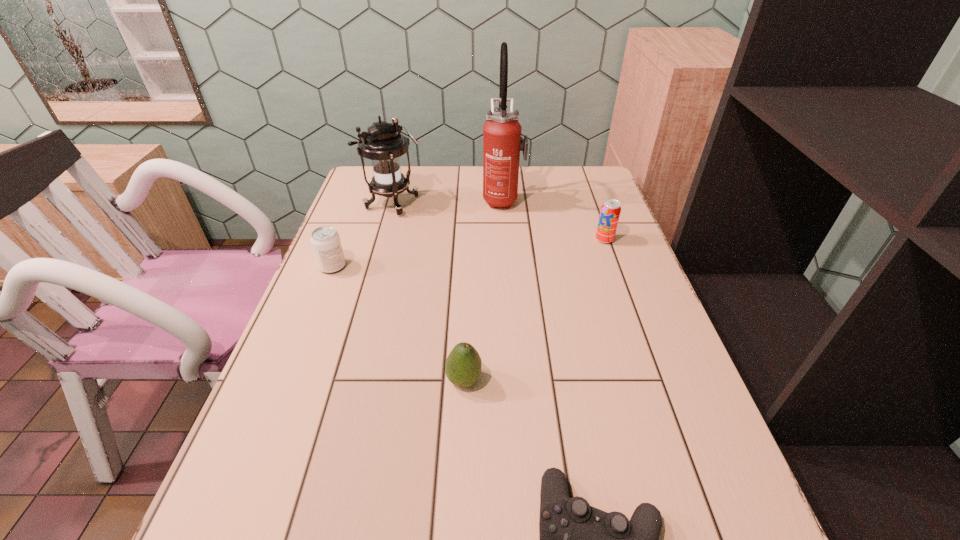
The image size is (960, 540). Identify the location of object present at the far left corner. (383, 143).

You are a GUI agent. You are given a task and a screenshot of the screen. Output one action in this format:
    pyautogui.click(x=<x>, y=<y>)
    Task: Click on the vacant position at the far edge of the desktop
    Image resolution: width=960 pixels, height=540 pixels.
    Given the screenshot: What is the action you would take?
    pyautogui.click(x=474, y=193)

I want to click on free space at the left edge of the desktop, so click(x=345, y=213).

Image resolution: width=960 pixels, height=540 pixels. I want to click on vacant space at the right edge of the desktop, so click(x=608, y=284).

Identify the location of free space at the far right corner. (588, 172).

Locate an element on the screen. The height and width of the screenshot is (540, 960). free space between the fourth object from right to left and the second tallest object is located at coordinates (429, 292).

Where is `vacant area between the avocado and the fifth shortest object`? The image size is (960, 540). vacant area between the avocado and the fifth shortest object is located at coordinates (429, 292).

Find the location of a particular element. The height and width of the screenshot is (540, 960). vacant space in between the avocado and the right soda can is located at coordinates (534, 310).

This screenshot has width=960, height=540. I want to click on blank region between the farther soda can and the tallest object, so click(x=554, y=219).

Where is `free space between the fifth farthest object and the right soda can`? The image size is (960, 540). free space between the fifth farthest object and the right soda can is located at coordinates (534, 310).